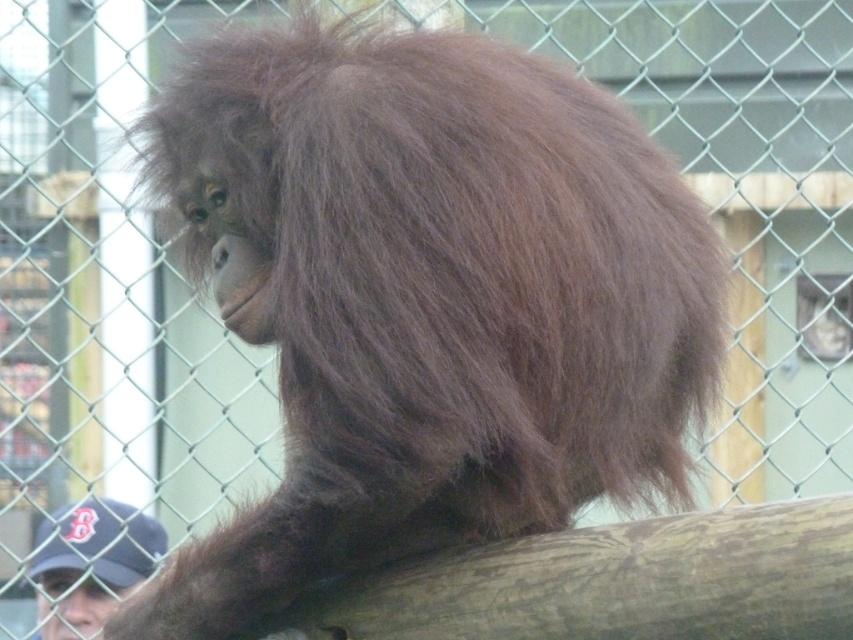
Question: Is brown furry orangutan at center closer to the viewer compared to dark blue baseball cap at lower left?

Choices:
 (A) no
 (B) yes

Answer: (B)

Question: Among these objects, which one is nearest to the camera?

Choices:
 (A) brown furry orangutan at center
 (B) dark blue baseball cap at lower left

Answer: (A)

Question: Which point is closer to the camera?

Choices:
 (A) (56, 618)
 (B) (189, 116)

Answer: (B)

Question: Is brown furry orangutan at center wider than dark blue baseball cap at lower left?

Choices:
 (A) no
 (B) yes

Answer: (B)

Question: Does brown furry orangutan at center have a lesser width compared to dark blue baseball cap at lower left?

Choices:
 (A) yes
 (B) no

Answer: (B)